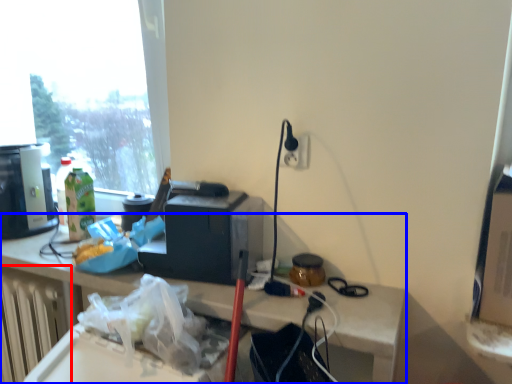
Question: Among these objects, which one is farthest to the camera, radiator (highlighted by a red box) or desk (highlighted by a blue box)?

Choices:
 (A) radiator
 (B) desk

Answer: (A)